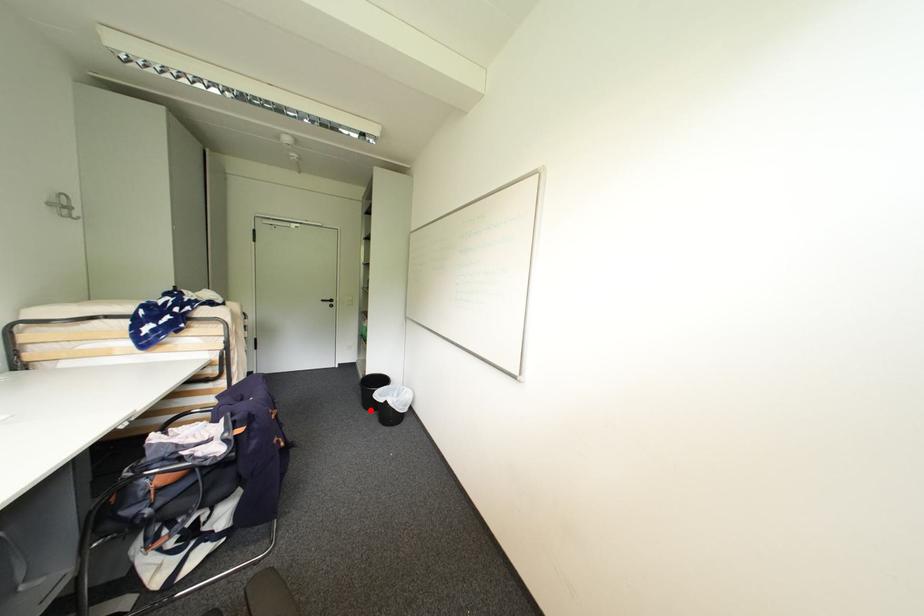
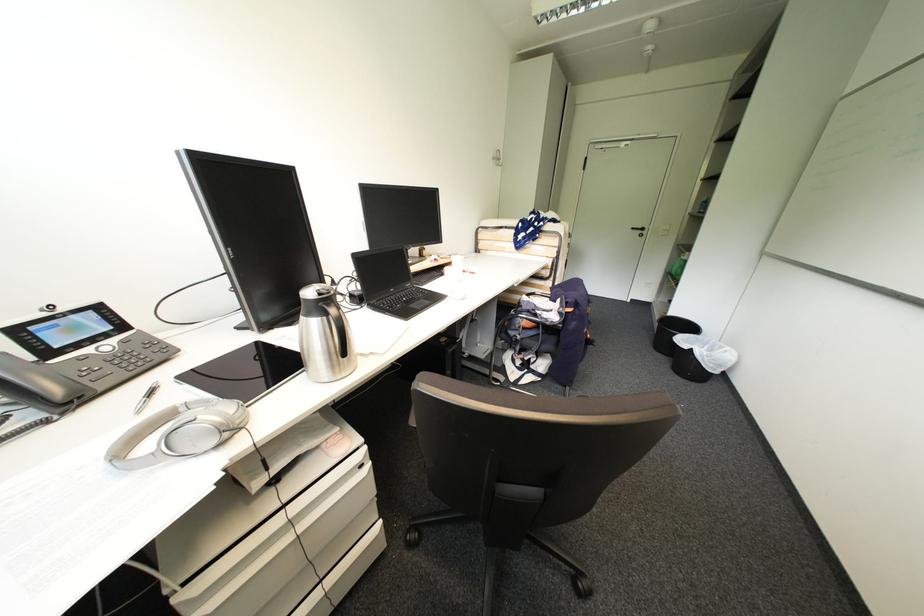
The point at the highlighted location is marked in the first image. Where is the corresponding point in the second image?

(660, 351)